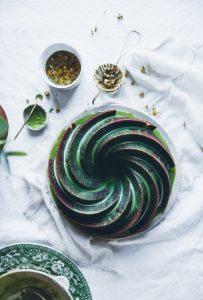
This screenshot has height=300, width=203. Find the location of `small spots on tablecloth`. small spots on tablecloth is located at coordinates (46, 91), (53, 109), (58, 108), (141, 95), (155, 113), (98, 30), (119, 14).